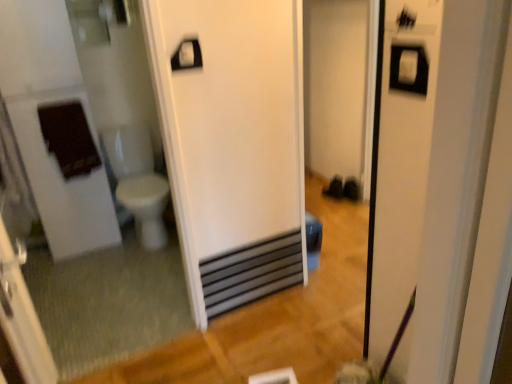
Question: Can you confirm if white plastic towel bar at upper center is smaller than white glossy toilet bowl at left?

Choices:
 (A) yes
 (B) no

Answer: (A)

Question: Considering the relative sizes of white plastic towel bar at upper center and white glossy toilet bowl at left in the image provided, is white plastic towel bar at upper center wider than white glossy toilet bowl at left?

Choices:
 (A) no
 (B) yes

Answer: (A)

Question: Is white glossy toilet bowl at left a part of white plastic towel bar at upper center?

Choices:
 (A) no
 (B) yes

Answer: (A)

Question: Considering the relative sizes of white plastic towel bar at upper center and white glossy toilet bowl at left in the image provided, is white plastic towel bar at upper center bigger than white glossy toilet bowl at left?

Choices:
 (A) no
 (B) yes

Answer: (A)

Question: Considering the relative sizes of white plastic towel bar at upper center and white glossy toilet bowl at left in the image provided, is white plastic towel bar at upper center taller than white glossy toilet bowl at left?

Choices:
 (A) yes
 (B) no

Answer: (B)

Question: From a real-world perspective, is white plastic towel bar at upper center positioned under white glossy toilet bowl at left based on gravity?

Choices:
 (A) yes
 (B) no

Answer: (B)

Question: Is white glossy mirror at left shorter than black metallic water heater at center?

Choices:
 (A) yes
 (B) no

Answer: (B)

Question: Does white glossy mirror at left have a greater height compared to black metallic water heater at center?

Choices:
 (A) no
 (B) yes

Answer: (B)

Question: Are white glossy mirror at left and black metallic water heater at center located far from each other?

Choices:
 (A) yes
 (B) no

Answer: (B)

Question: From the image's perspective, does white glossy mirror at left appear lower than black metallic water heater at center?

Choices:
 (A) yes
 (B) no

Answer: (B)

Question: From a real-world perspective, is white glossy mirror at left below black metallic water heater at center?

Choices:
 (A) no
 (B) yes

Answer: (A)

Question: Considering the relative sizes of white glossy mirror at left and black metallic water heater at center in the image provided, is white glossy mirror at left smaller than black metallic water heater at center?

Choices:
 (A) yes
 (B) no

Answer: (B)

Question: Can you confirm if black metallic water heater at center is taller than white plastic towel bar at upper center?

Choices:
 (A) no
 (B) yes

Answer: (B)